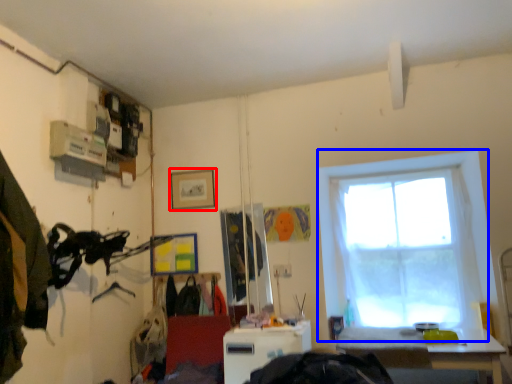
Question: Which of the following is the closest to the observer, picture frame (highlighted by a red box) or window (highlighted by a blue box)?

Choices:
 (A) picture frame
 (B) window

Answer: (B)